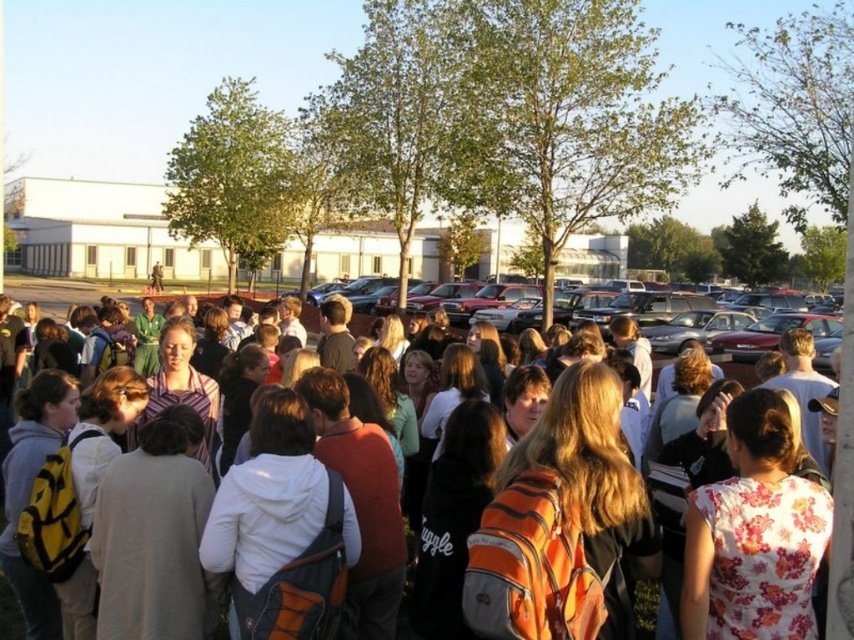
You are a photographer positioned at the edge of the parking lot. You want to capture a photo of the orange backpack at center without the metallic silver sedan at center blocking it. Which direction should you move to ensure the sedan is out of frame?

The metallic silver sedan at center is located above the orange backpack at center, so you should move downward to position yourself below the sedan to avoid it blocking the backpack.

You are standing at the entrance of the school building and want to reach the metallic silver sedan at center. Which direction should you walk to get there?

Walk towards the center of the parking lot where the metallic silver sedan at center is located.